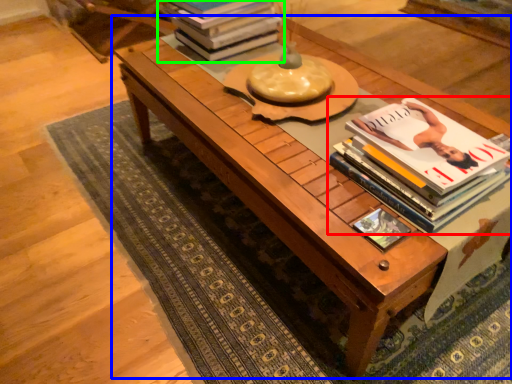
Question: Estimate the real-world distances between objects in this image. Which object is farther from book (highlighted by a red box), table (highlighted by a blue box) or book (highlighted by a green box)?

Choices:
 (A) table
 (B) book

Answer: (B)